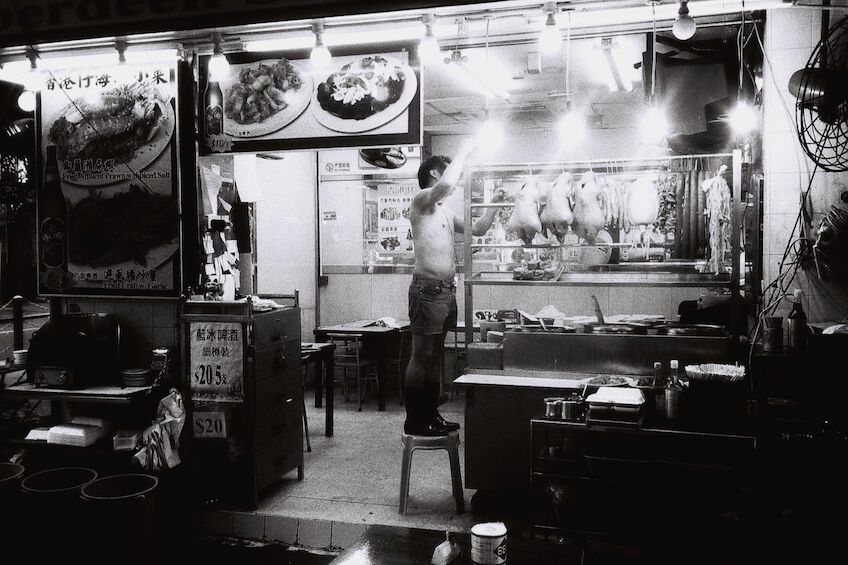
You are a GUI agent. You are given a task and a screenshot of the screen. Output one action in this format:
    pyautogui.click(x=<x>, y=<y>)
    Task: Click on the food posters
    
    Given the screenshot: What is the action you would take?
    pyautogui.click(x=392, y=210), pyautogui.click(x=381, y=162), pyautogui.click(x=483, y=251), pyautogui.click(x=114, y=118), pyautogui.click(x=119, y=227), pyautogui.click(x=254, y=94), pyautogui.click(x=363, y=91)